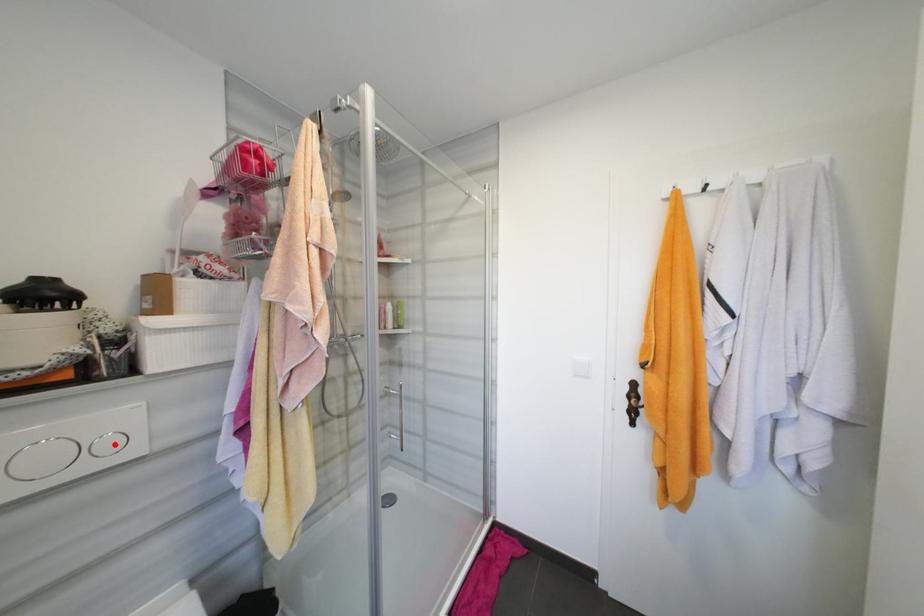
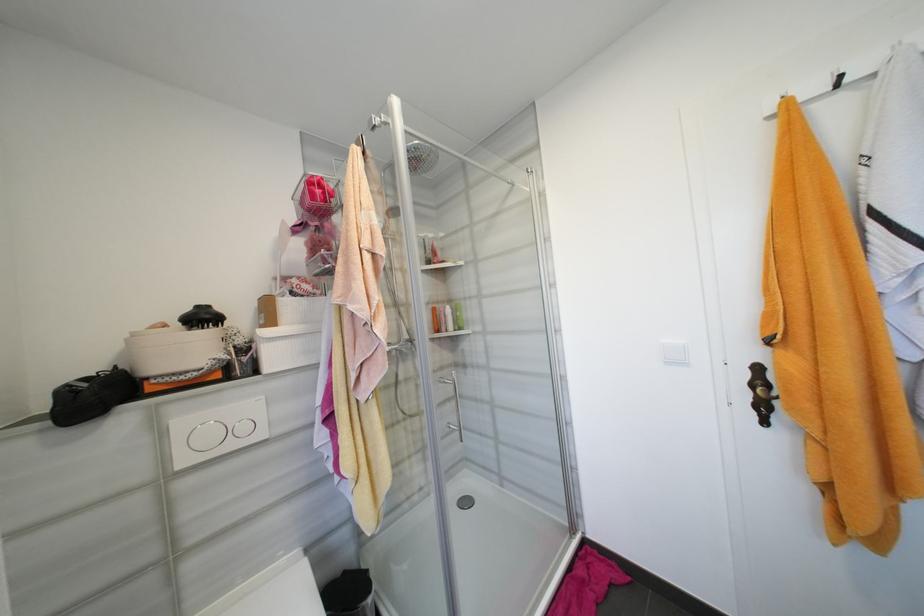
Find the pixel in the second image that matches the highlighted location in the first image.

(249, 429)